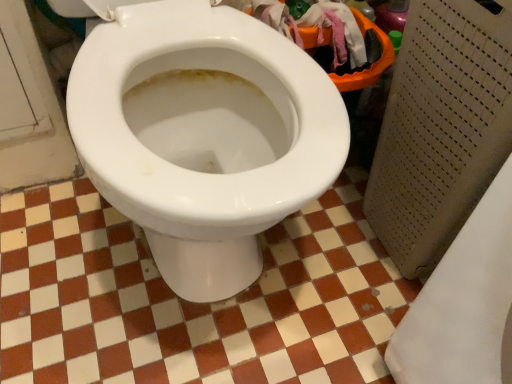
Question: From the image's perspective, is white glossy tile at center on top of white glossy toilet at center?

Choices:
 (A) yes
 (B) no

Answer: (B)

Question: Is white glossy tile at center taller than white glossy toilet at center?

Choices:
 (A) yes
 (B) no

Answer: (B)

Question: Would you consider white glossy tile at center to be distant from white glossy toilet at center?

Choices:
 (A) no
 (B) yes

Answer: (A)

Question: From a real-world perspective, is white glossy tile at center positioned under white glossy toilet at center based on gravity?

Choices:
 (A) yes
 (B) no

Answer: (A)

Question: Is white glossy tile at center to the right of white glossy toilet at center from the viewer's perspective?

Choices:
 (A) no
 (B) yes

Answer: (B)

Question: Does white glossy tile at center come in front of white glossy toilet at center?

Choices:
 (A) no
 (B) yes

Answer: (A)

Question: Is the position of white glossy toilet at center less distant than that of white glossy tile at center?

Choices:
 (A) yes
 (B) no

Answer: (A)

Question: Can white glossy tile at center be found inside white glossy toilet at center?

Choices:
 (A) yes
 (B) no

Answer: (B)

Question: Is white glossy toilet at center facing away from white glossy tile at center?

Choices:
 (A) no
 (B) yes

Answer: (A)

Question: Does white glossy toilet at center have a greater height compared to white glossy tile at center?

Choices:
 (A) yes
 (B) no

Answer: (A)

Question: Is white glossy toilet at center not close to white glossy tile at center?

Choices:
 (A) no
 (B) yes

Answer: (A)

Question: Considering the relative sizes of white glossy toilet at center and white glossy tile at center in the image provided, is white glossy toilet at center bigger than white glossy tile at center?

Choices:
 (A) no
 (B) yes

Answer: (B)

Question: Is white glossy tile at center taller or shorter than white glossy toilet at center?

Choices:
 (A) tall
 (B) short

Answer: (B)